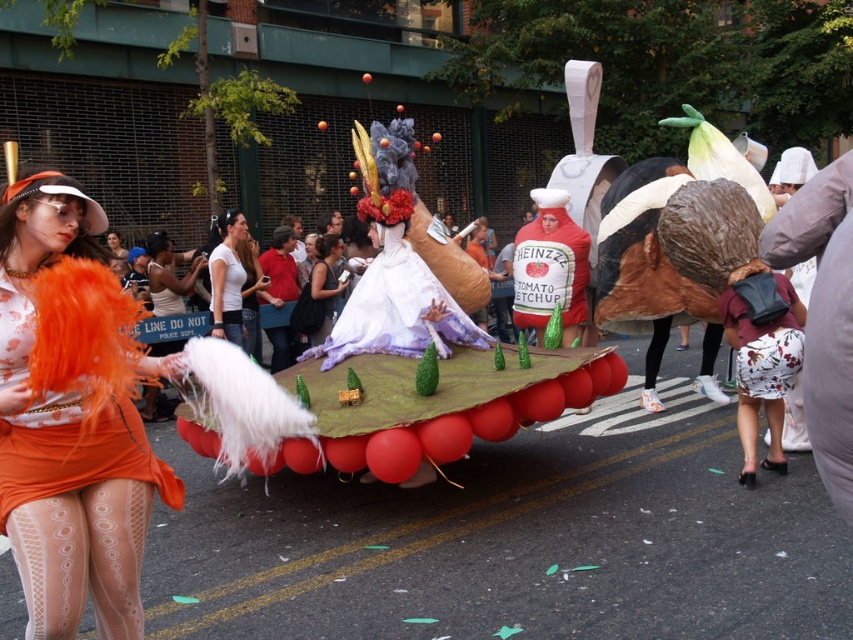
You are a photographer at the parade. You want to capture both the white matte shirt at center and the matte white dress at center in a single photo. Which one should you focus on to ensure both are in frame without cropping?

The white matte shirt at center is larger than the matte white dress at center, so focusing on the white matte shirt at center will help ensure both are visible in the frame without cropping.